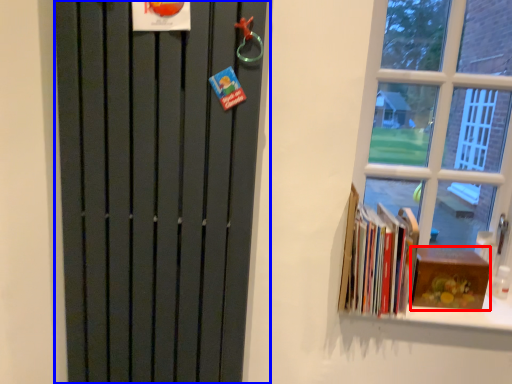
Question: Which object is closer to the camera taking this photo, paperback book (highlighted by a red box) or door (highlighted by a blue box)?

Choices:
 (A) paperback book
 (B) door

Answer: (B)